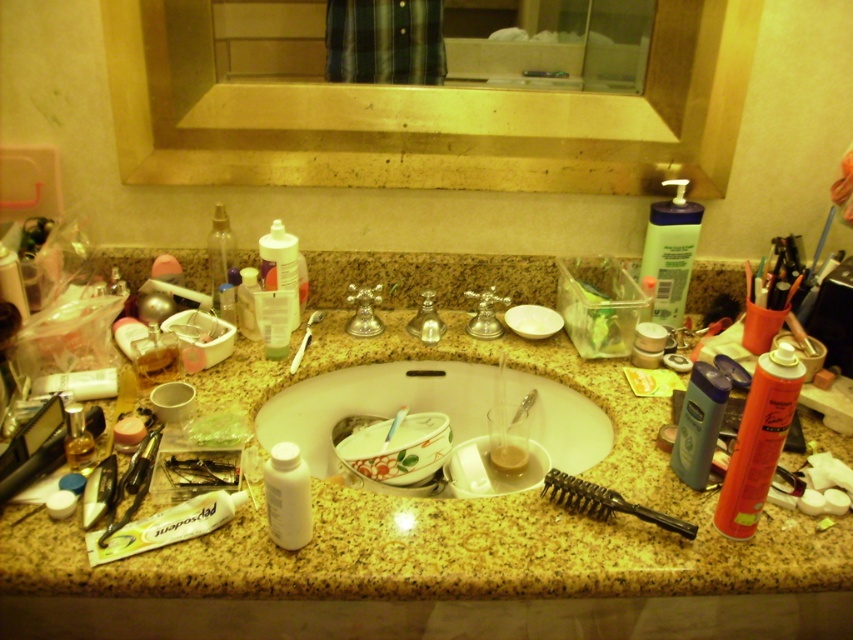
Can you confirm if gold textured mirror at upper center is wider than white plastic pump bottle at right?

Yes.

In order to click on gold textured mirror at upper center in this screenshot , I will do `click(416, 104)`.

Does point (212, 77) lie behind point (691, 228)?

No, (212, 77) is closer to viewer.

This screenshot has height=640, width=853. I want to click on gold textured mirror at upper center, so click(x=416, y=104).

Does white plastic pump bottle at right have a greater width compared to gold metallic faucet at center?

Yes, white plastic pump bottle at right is wider than gold metallic faucet at center.

Between white plastic pump bottle at right and gold metallic faucet at center, which one has more height?

white plastic pump bottle at right

Who is more forward, (663,205) or (352,288)?

Positioned in front is point (663,205).

The width and height of the screenshot is (853, 640). Identify the location of white plastic pump bottle at right. (669, 252).

In the scene shown: Is gold metallic faucet at center smaller than translucent plastic bottle at left?

No, gold metallic faucet at center is not smaller than translucent plastic bottle at left.

Is gold metallic faucet at center in front of translucent plastic bottle at left?

No, it is behind translucent plastic bottle at left.

Locate an element on the screen. This screenshot has height=640, width=853. gold metallic faucet at center is located at coordinates (364, 310).